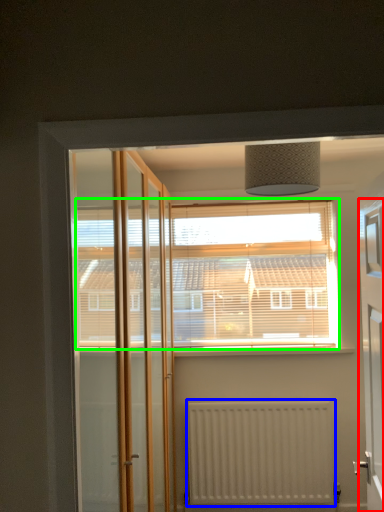
Question: Which is nearer to the elevator (highlighted by a red box)? radiator (highlighted by a blue box) or window (highlighted by a green box).

Choices:
 (A) radiator
 (B) window

Answer: (B)